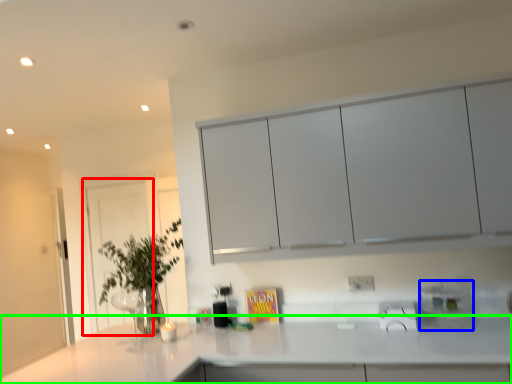
Question: Based on their relative distances, which object is nearer to glass door (highlighted by a red box)? Choose from appliance (highlighted by a blue box) and countertop (highlighted by a green box).

Choices:
 (A) appliance
 (B) countertop

Answer: (B)